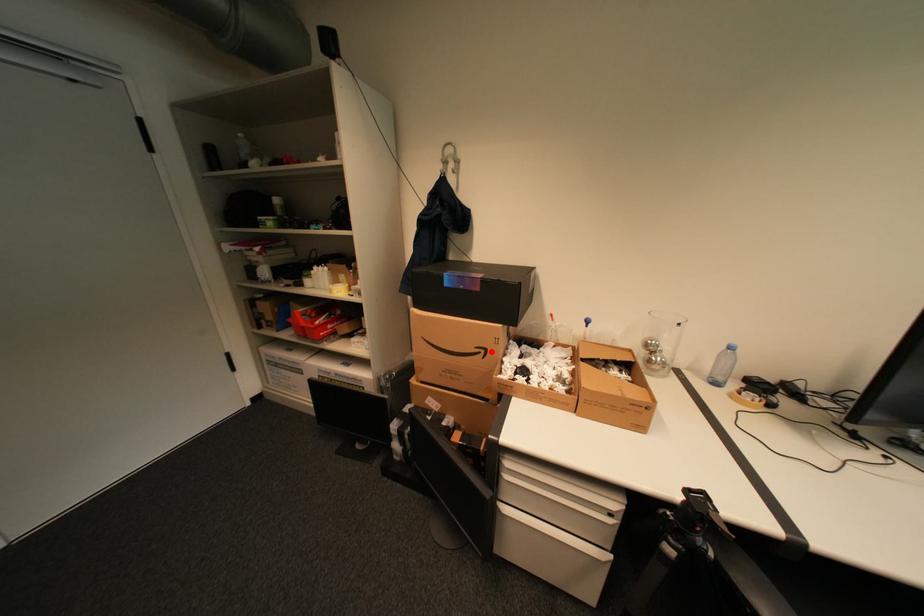
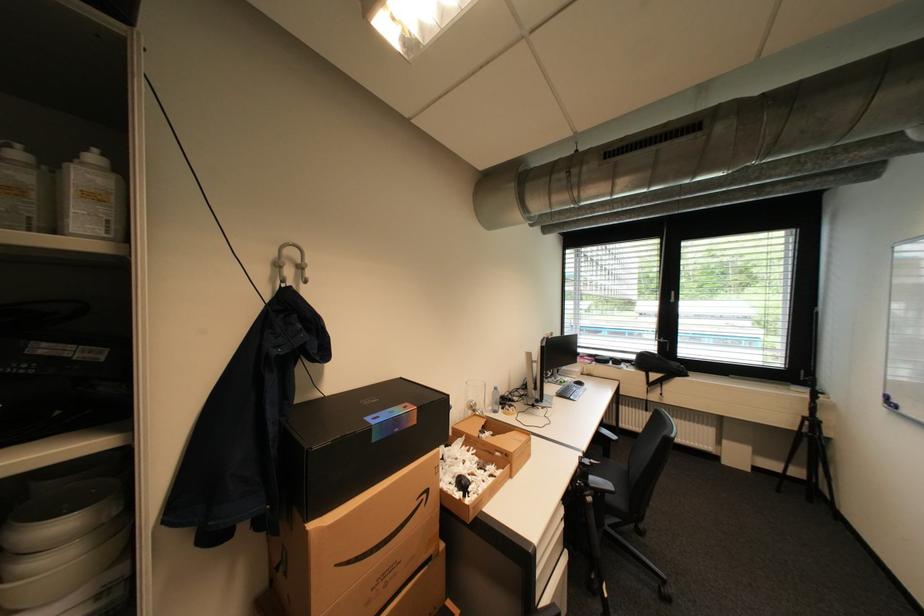
Find the pixel in the second image that matches the highlighted location in the first image.

(433, 496)